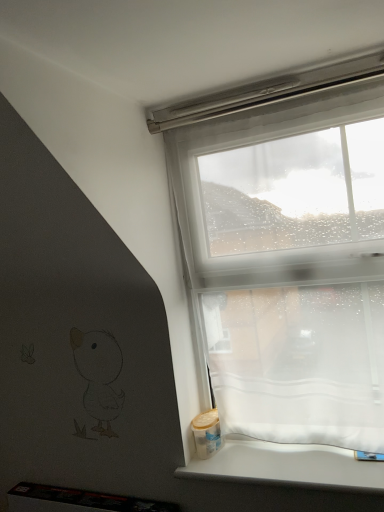
Question: From a real-world perspective, is transparent fabric at upper right physically below white matte window sill at lower right?

Choices:
 (A) yes
 (B) no

Answer: (B)

Question: From a real-world perspective, does transparent fabric at upper right stand above white matte window sill at lower right?

Choices:
 (A) no
 (B) yes

Answer: (B)

Question: Are transparent fabric at upper right and white matte window sill at lower right far apart?

Choices:
 (A) no
 (B) yes

Answer: (A)

Question: Is transparent fabric at upper right facing towards white matte window sill at lower right?

Choices:
 (A) no
 (B) yes

Answer: (A)

Question: From the image's perspective, is transparent fabric at upper right beneath white matte window sill at lower right?

Choices:
 (A) no
 (B) yes

Answer: (A)

Question: Is transparent fabric at upper right to the left of white matte window sill at lower right from the viewer's perspective?

Choices:
 (A) yes
 (B) no

Answer: (B)

Question: Is white matte window sill at lower right far away from transparent fabric at upper right?

Choices:
 (A) no
 (B) yes

Answer: (A)

Question: Is white matte window sill at lower right at the right side of transparent fabric at upper right?

Choices:
 (A) yes
 (B) no

Answer: (B)

Question: Is the position of white matte window sill at lower right more distant than that of transparent fabric at upper right?

Choices:
 (A) no
 (B) yes

Answer: (A)

Question: Would you say transparent fabric at upper right is part of white matte window sill at lower right's contents?

Choices:
 (A) yes
 (B) no

Answer: (B)

Question: From a real-world perspective, is white matte window sill at lower right beneath transparent fabric at upper right?

Choices:
 (A) no
 (B) yes

Answer: (B)

Question: From a real-world perspective, is white matte window sill at lower right physically above transparent fabric at upper right?

Choices:
 (A) yes
 (B) no

Answer: (B)

Question: Considering their positions, is white matte window sill at lower right located in front of or behind transparent fabric at upper right?

Choices:
 (A) behind
 (B) front

Answer: (B)